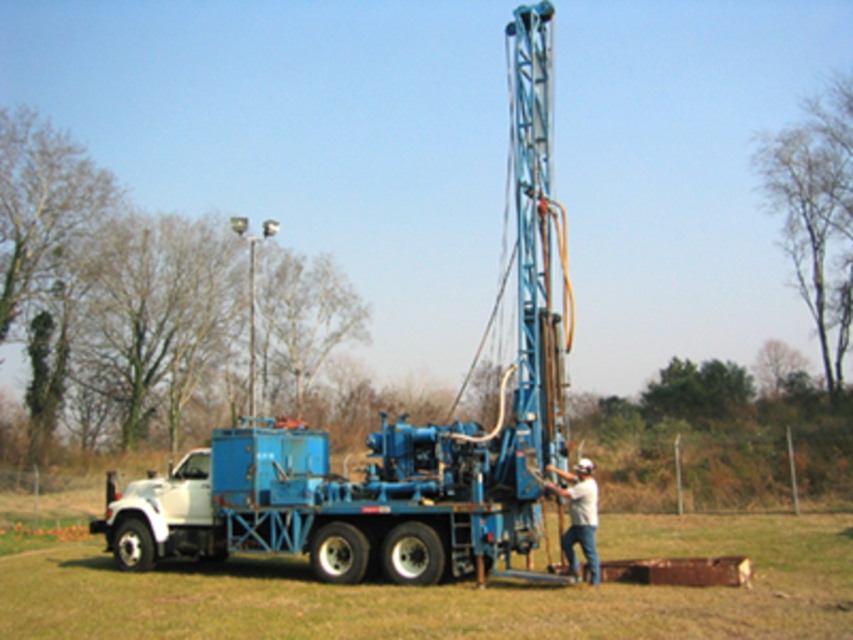
Is point (245, 541) positioned after point (590, 563)?

That is True.

Does point (531, 44) come in front of point (585, 515)?

No, (531, 44) is behind (585, 515).

Between point (183, 483) and point (590, 481), which one is positioned behind?

Point (183, 483)

Image resolution: width=853 pixels, height=640 pixels. In order to click on matte blue truck at center in this screenshot , I will do `click(396, 433)`.

Between blue metallic truck at center and light beige fabric shirt at center, which one has more height?

Standing taller between the two is blue metallic truck at center.

Between blue metallic truck at center and light beige fabric shirt at center, which one appears on the right side from the viewer's perspective?

light beige fabric shirt at center is more to the right.

Does point (836, 577) come behind point (585, 493)?

That is True.

The height and width of the screenshot is (640, 853). Identify the location of blue metallic truck at center. (451, 592).

Locate an element on the screen. The width and height of the screenshot is (853, 640). matte blue truck at center is located at coordinates (396, 433).

Is matte blue truck at center closer to the viewer compared to blue metallic truck at center?

That is False.

Locate an element on the screen. The height and width of the screenshot is (640, 853). matte blue truck at center is located at coordinates [396, 433].